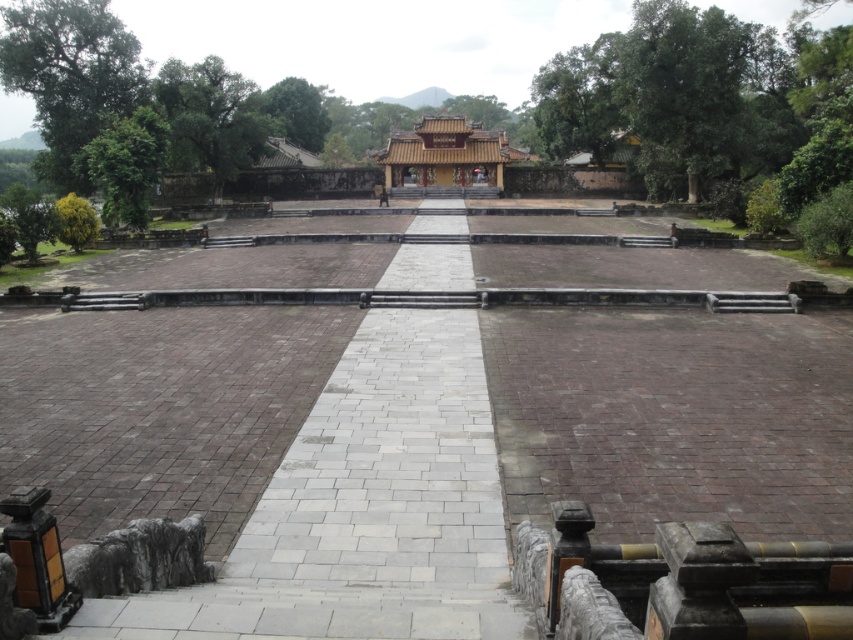
Based on the photo, you are standing at the entrance of the East Asian architectural complex and see the gray stone path at center and the golden lacquered palace at center. Which object is positioned to the left side from your perspective?

The gray stone path at center is to the left of golden lacquered palace at center, so the gray stone path at center is positioned to the left side from your perspective.

You are a visitor at this historical site and want to walk along the gray stone path at center to reach the golden lacquered palace at center. Based on their widths, which one is narrower?

The gray stone path at center is thinner than the golden lacquered palace at center, so the gray stone path at center is narrower.